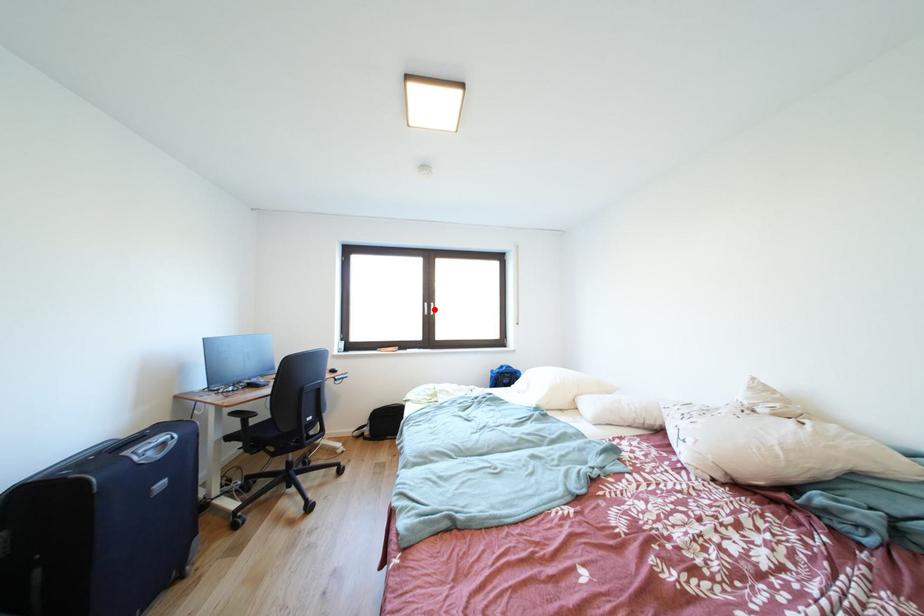
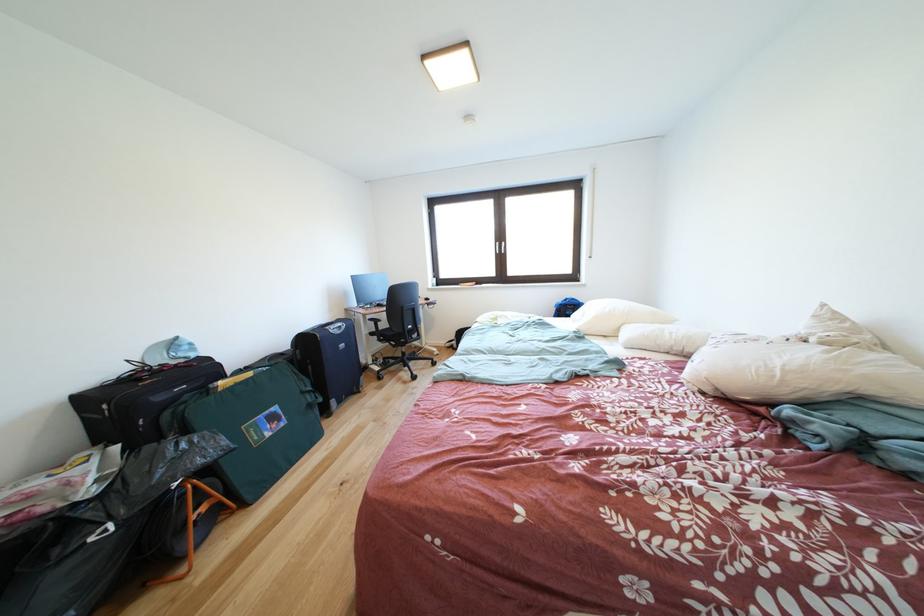
Question: I am providing you with two images of the same scene from different viewpoints. In image1, a red point is highlighted. Considering the same 3D point in image2, which of the following is correct?

Choices:
 (A) It is closer
 (B) It is farther

Answer: (A)